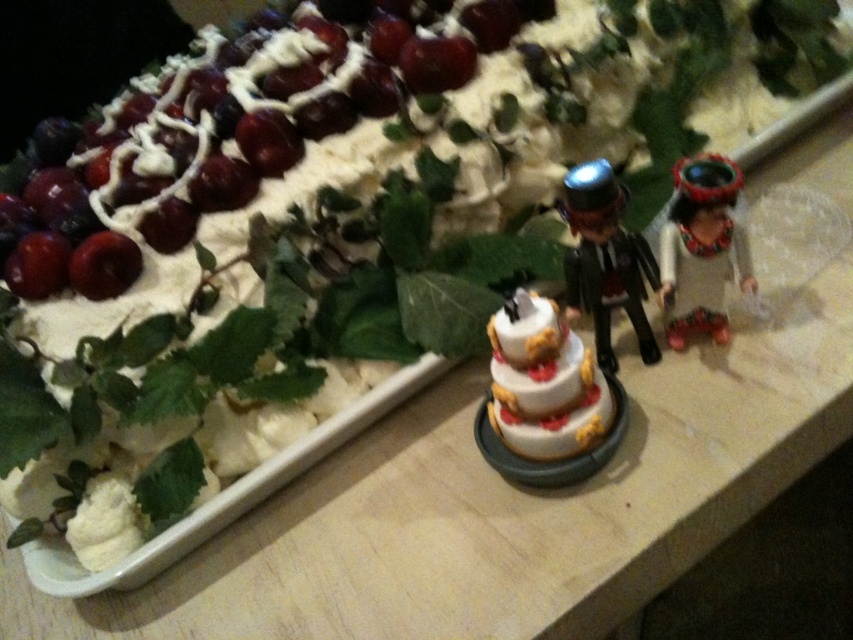
You are a guest at a party and want to place a small gift on the wooden surface near the shiny red cherries at upper left and the shiny black toy at center. Where should you place it so it doesn

The shiny red cherries at upper left is positioned over the shiny black toy at center, so placing the gift below the shiny red cherries at upper left would ensure it is near both objects.

You are planning to place a decorative candle on the largest object in the scene. Which object should you choose between the white matte tiered cake at center and the shiny plastic bride at right?

The white matte tiered cake at center has a larger size compared to the shiny plastic bride at right, so you should place the decorative candle on the white matte tiered cake at center.